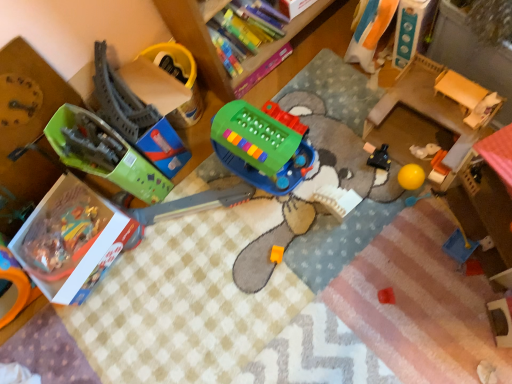
You are a GUI agent. You are given a task and a screenshot of the screen. Output one action in this format:
    pyautogui.click(x=<x>, y=<y>)
    Task: Click on the vacant space behind wooden changing table at right
    The height and width of the screenshot is (384, 512).
    Given the screenshot: What is the action you would take?
    pyautogui.click(x=347, y=102)